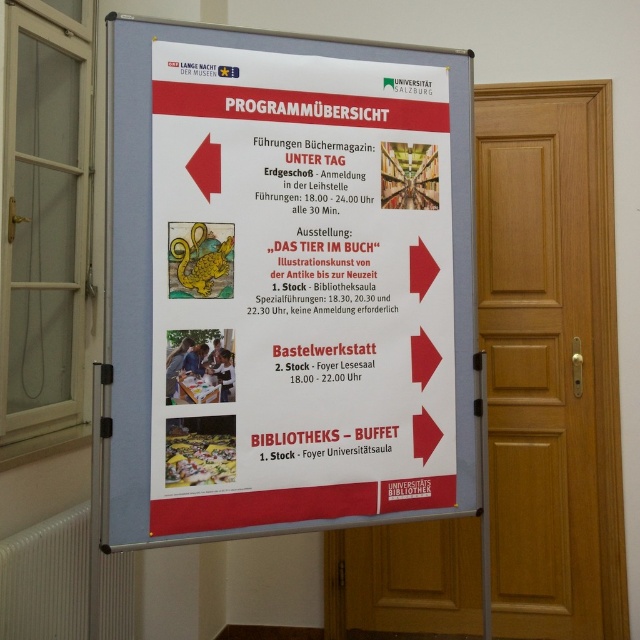
Which is above, white paper poster at center or wooden door at right?

white paper poster at center is higher up.

Is point (365, 308) less distant than point (609, 499)?

Yes, it is.

Locate an element on the screen. white paper poster at center is located at coordinates (300, 289).